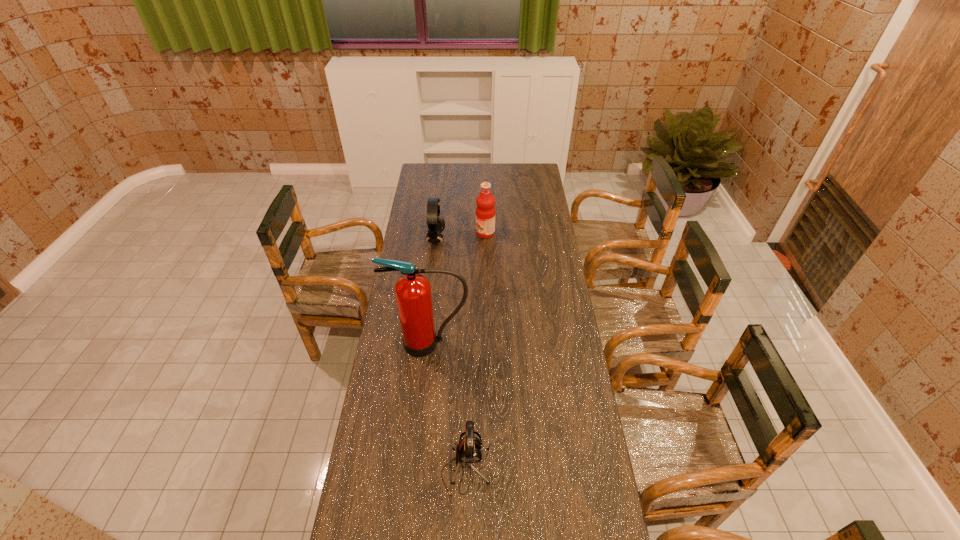
Locate an element on the screen. The width and height of the screenshot is (960, 540). vacant space that satisfies the following two spatial constraints: 1. on the ear cups of the left earphone; 2. on the back side of the right earphone is located at coordinates (410, 470).

Image resolution: width=960 pixels, height=540 pixels. I want to click on free space that satisfies the following two spatial constraints: 1. on the ear cups of the nearest object; 2. on the right side of the left earphone, so click(410, 470).

The height and width of the screenshot is (540, 960). I want to click on free space in the image that satisfies the following two spatial constraints: 1. on the ear cups of the left earphone; 2. on the back side of the second nearest object, so click(x=424, y=343).

You are a GUI agent. You are given a task and a screenshot of the screen. Output one action in this format:
    pyautogui.click(x=<x>, y=<y>)
    Task: Click on the free region that satisfies the following two spatial constraints: 1. on the ear cups of the nearer earphone; 2. on the left side of the left earphone
    The height and width of the screenshot is (540, 960).
    Given the screenshot: What is the action you would take?
    pyautogui.click(x=410, y=470)